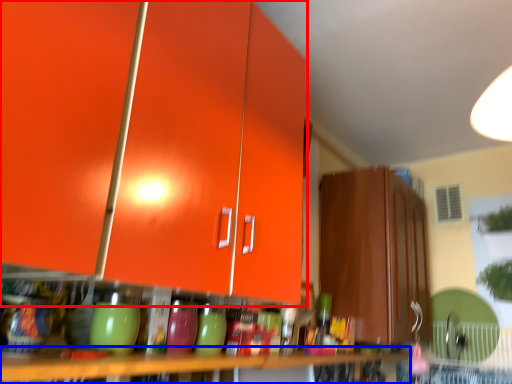
Question: Which object appears farthest to the camera in this image, cabinetry (highlighted by a red box) or table (highlighted by a blue box)?

Choices:
 (A) cabinetry
 (B) table

Answer: (B)